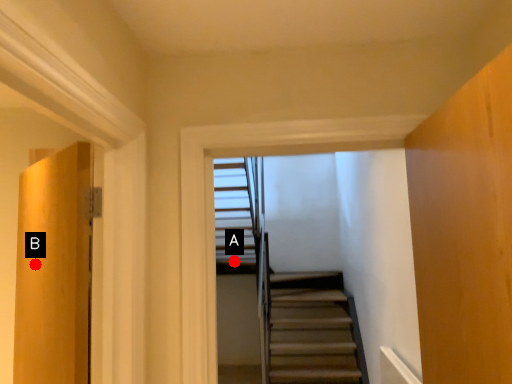
Question: Two points are circled on the image, labeled by A and B beside each circle. Among these points, which one is nearest to the camera?

Choices:
 (A) A is closer
 (B) B is closer

Answer: (B)